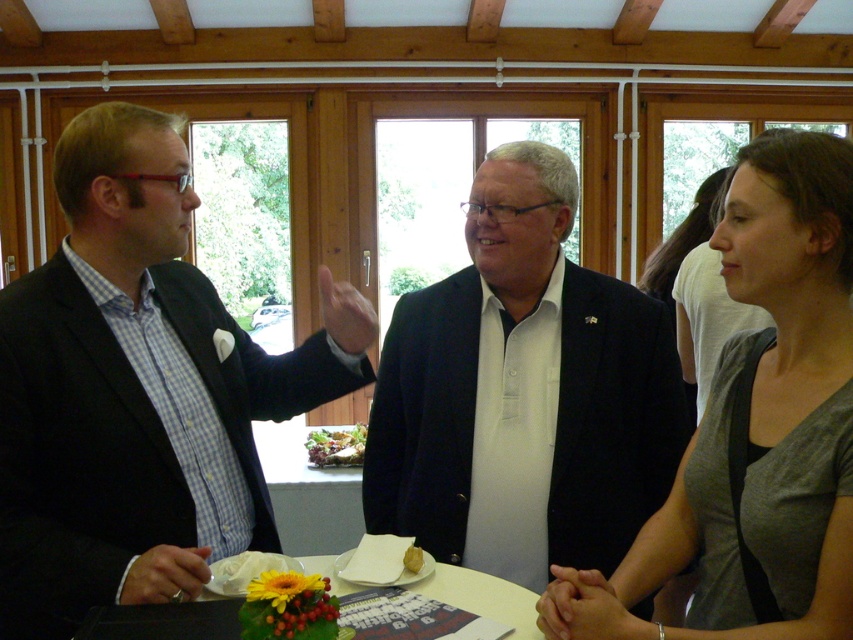
Question: Which object is positioned farthest from the yellow flower at center?

Choices:
 (A) green leafy salad at center
 (B) gray cotton shirt at center
 (C) matte black suit at left
 (D) white glossy table at lower center

Answer: (A)

Question: Which object is the farthest from the gray cotton shirt at center?

Choices:
 (A) yellow matte bread at center
 (B) green leafy salad at center
 (C) yellow flower at center
 (D) white glossy table at lower center

Answer: (B)

Question: Which point appears farthest from the camera in this image?

Choices:
 (A) (320, 451)
 (B) (190, 292)

Answer: (A)

Question: Is gray cotton shirt at center above white glossy table at lower center?

Choices:
 (A) yes
 (B) no

Answer: (A)

Question: Is dark blue suit at center to the left of green leafy salad at center from the viewer's perspective?

Choices:
 (A) no
 (B) yes

Answer: (A)

Question: Is dark blue suit at center wider than yellow matte bread at center?

Choices:
 (A) no
 (B) yes

Answer: (B)